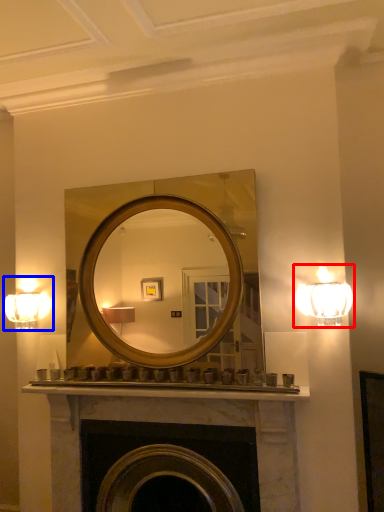
Question: Which of the following is the farthest to the observer, lamp (highlighted by a red box) or fixture (highlighted by a blue box)?

Choices:
 (A) lamp
 (B) fixture

Answer: (B)